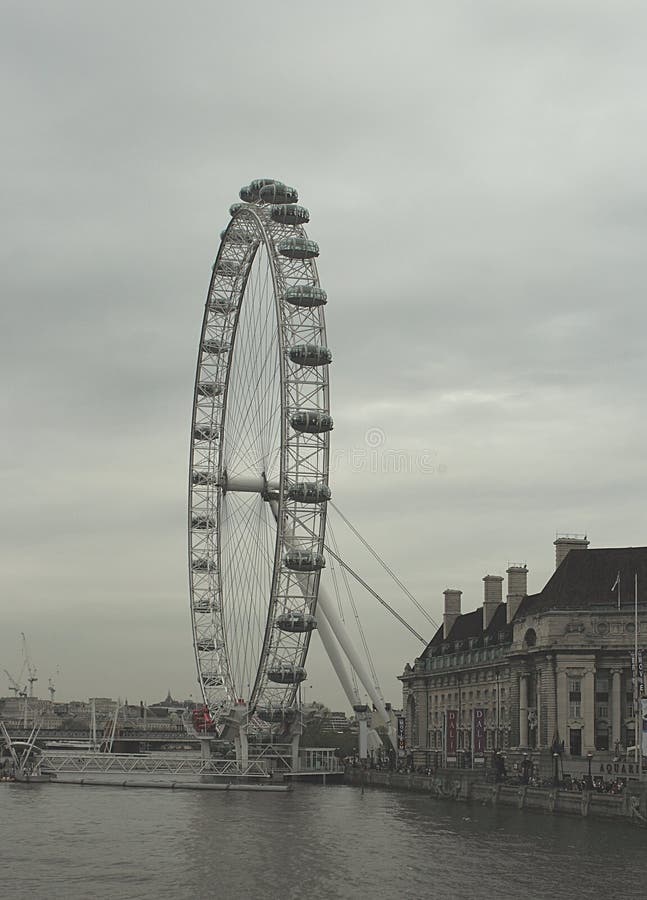
I want to click on chimney, so click(565, 547), click(517, 592), click(498, 592), click(451, 608).